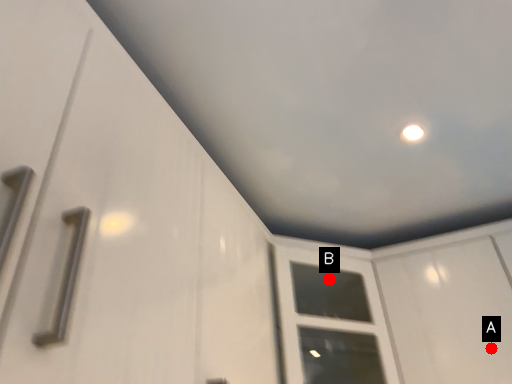
Question: Two points are circled on the image, labeled by A and B beside each circle. Which point is closer to the camera?

Choices:
 (A) A is closer
 (B) B is closer

Answer: (A)